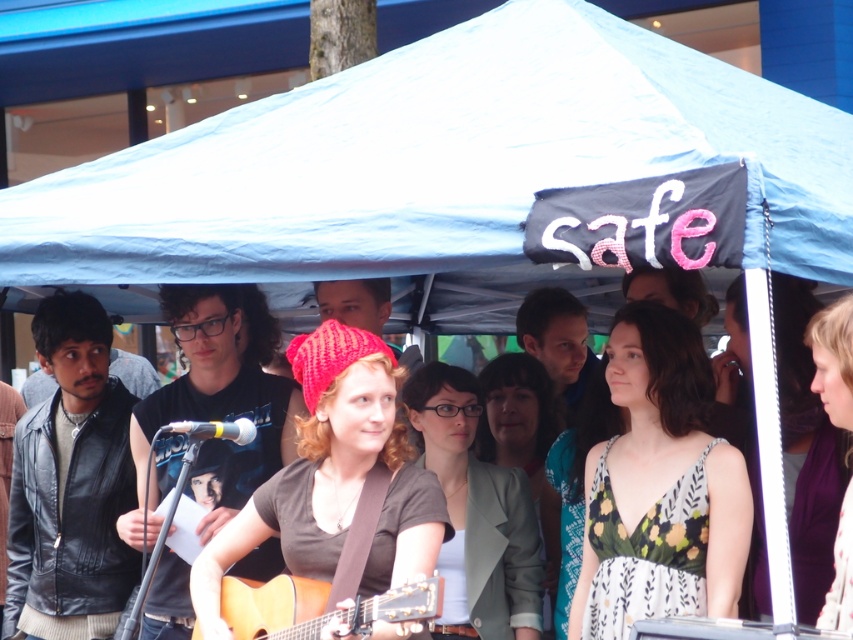
Question: Which is nearer to the purple fabric dress at center?

Choices:
 (A) knitted red beanie at center
 (B) floral dress at center
 (C) light gray fabric jacket at center

Answer: (B)

Question: Which object is the farthest from the knitted red beanie at center?

Choices:
 (A) matte gray blazer at center
 (B) black t-shirt at center
 (C) smooth brown shirt at center
 (D) acoustic wood guitar at center

Answer: (C)

Question: Does matte gray blazer at center have a smaller size compared to smooth brown hair at center?

Choices:
 (A) yes
 (B) no

Answer: (B)

Question: Can you confirm if light gray fabric jacket at center is positioned below smooth brown hair at center?

Choices:
 (A) no
 (B) yes

Answer: (B)

Question: From the image, what is the correct spatial relationship of black t-shirt at center in relation to acoustic wood guitar at center?

Choices:
 (A) above
 (B) below

Answer: (A)

Question: Which of the following is the closest to the observer?

Choices:
 (A) (569, 499)
 (B) (403, 460)
 (C) (741, 528)

Answer: (C)